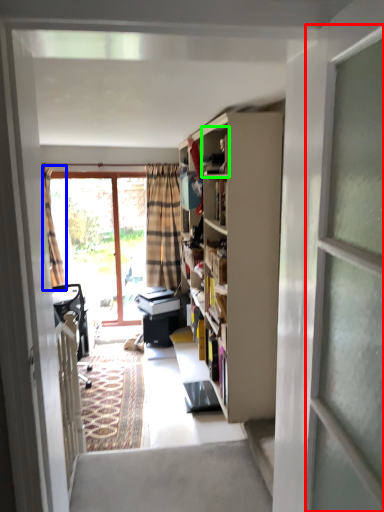
Question: Which object is the farthest from screen door (highlighted by a red box)? Choose among these: curtain (highlighted by a blue box) or cabinet (highlighted by a green box).

Choices:
 (A) curtain
 (B) cabinet

Answer: (A)